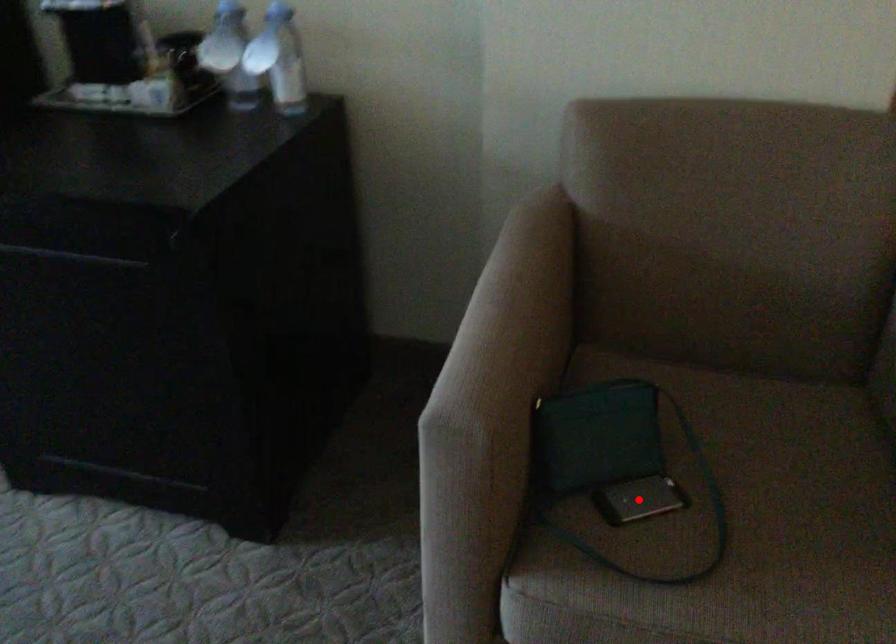
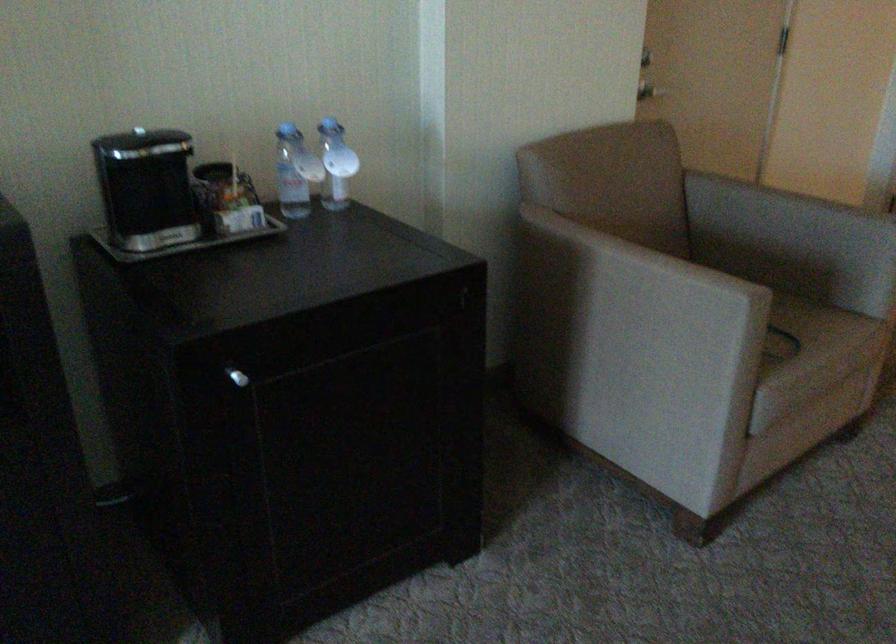
Question: I am providing you with two images of the same scene from different viewpoints. A red point is marked on the first image. At the location where the point appears in image 1, is it still visible in image 2?

Choices:
 (A) Yes
 (B) No

Answer: (B)